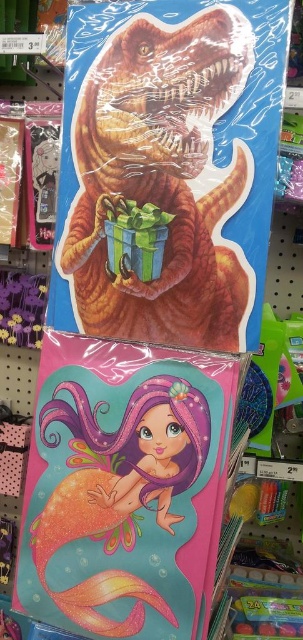
Consider the image. You are a customer in a store and you want to place both the shiny plastic dinosaur at center and the shiny orange mermaid at lower left on your car window. If your car window can only accommodate one of them due to space constraints, which one should you choose based on their sizes?

The shiny plastic dinosaur at center is wider than the shiny orange mermaid at lower left, so you should choose the shiny plastic dinosaur at center to place on your car window since it takes up more space.

You are a store employee arranging stickers on a shelf. You have to place the shiny plastic dinosaur at center and the shiny orange mermaid at lower left. The shelf is 10 inches wide. Can both items fit side by side on the shelf without overlapping?

The shiny plastic dinosaur at center and the shiny orange mermaid at lower left are 9.84 inches apart, so they can fit side by side on the 10 inch wide shelf since the distance between them is less than the shelf width.